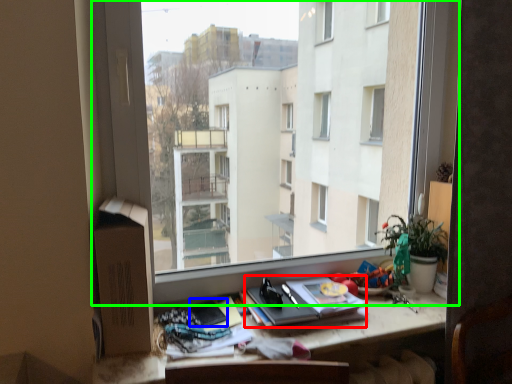
Question: Estimate the real-world distances between objects in this image. Which object is farther from paperback book (highlighted by a red box), paperback book (highlighted by a blue box) or window (highlighted by a green box)?

Choices:
 (A) paperback book
 (B) window

Answer: (B)